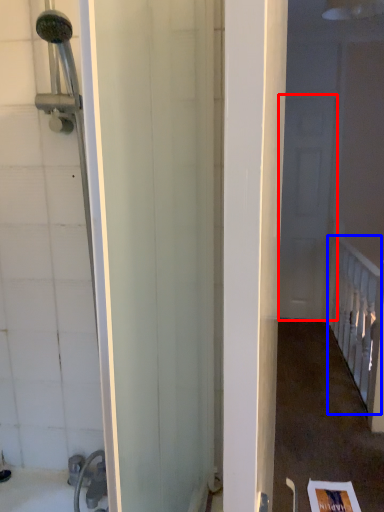
Question: Which point is closer to the camera, screen door (highlighted by a red box) or rail (highlighted by a blue box)?

Choices:
 (A) screen door
 (B) rail

Answer: (B)